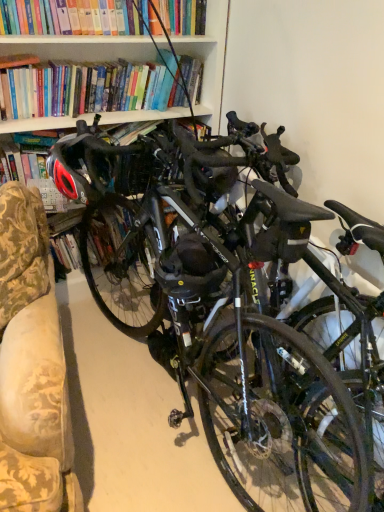
This screenshot has width=384, height=512. I want to click on free region under shiny black helmet at left (from a real-world perspective), so click(x=92, y=339).